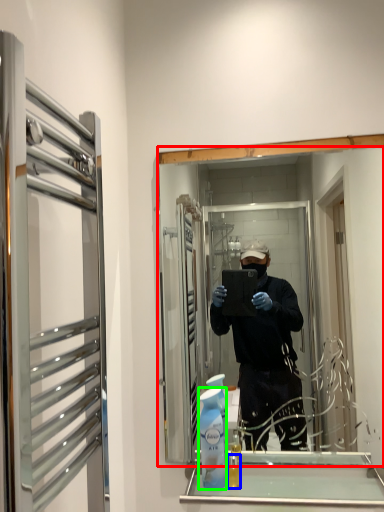
Question: Which object is the farthest from mirror (highlighted by a red box)? Choose among these: mouthwash (highlighted by a blue box) or cleaning product (highlighted by a green box).

Choices:
 (A) mouthwash
 (B) cleaning product

Answer: (A)